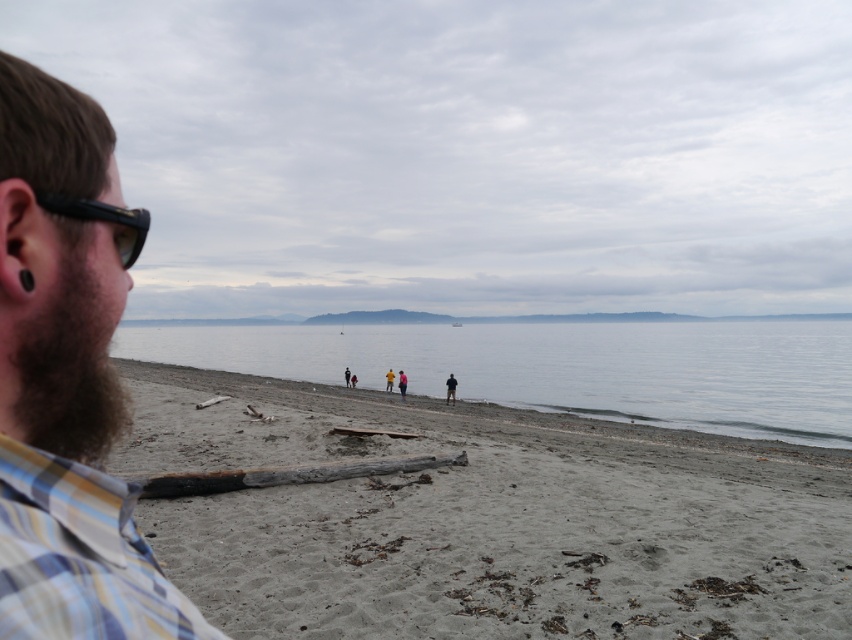
Question: Which object appears closest to the camera in this image?

Choices:
 (A) bearded man at left
 (B) dark brown fuzzy beard at left

Answer: (A)

Question: Which point is farther to the camera?

Choices:
 (A) charcoal wood log at lower center
 (B) clear water at center
 (C) dark brown fuzzy beard at left

Answer: (A)

Question: Does gray sandy beach at center come behind plaid cotton shirt at lower left?

Choices:
 (A) yes
 (B) no

Answer: (A)

Question: Can you confirm if plaid cotton shirt at lower left is positioned to the right of black plastic goggles at left?

Choices:
 (A) no
 (B) yes

Answer: (B)

Question: In this image, where is charcoal wood log at lower center located relative to pink fabric person at center?

Choices:
 (A) right
 (B) left

Answer: (A)

Question: Which of the following is the closest to the observer?

Choices:
 (A) bearded man at left
 (B) clear water at center
 (C) dark blue fabric at center
 (D) pink fabric person at center

Answer: (A)